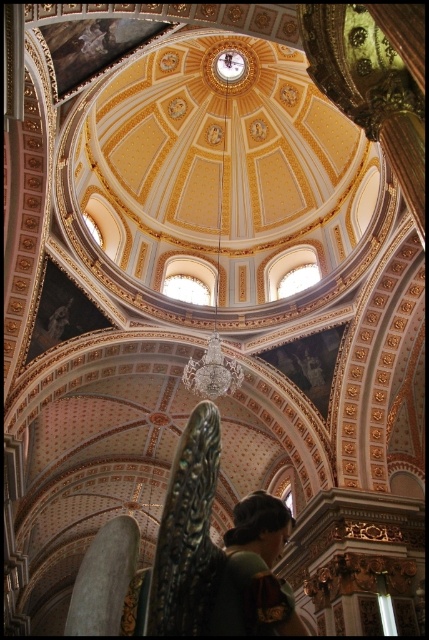
Can you confirm if green fabric headscarf at lower center is wider than gold metallic chandelier at center?

No.

Which is in front, point (302, 632) or point (215, 333)?

Point (302, 632) is in front.

Where is `green fabric headscarf at lower center`? green fabric headscarf at lower center is located at coordinates (256, 572).